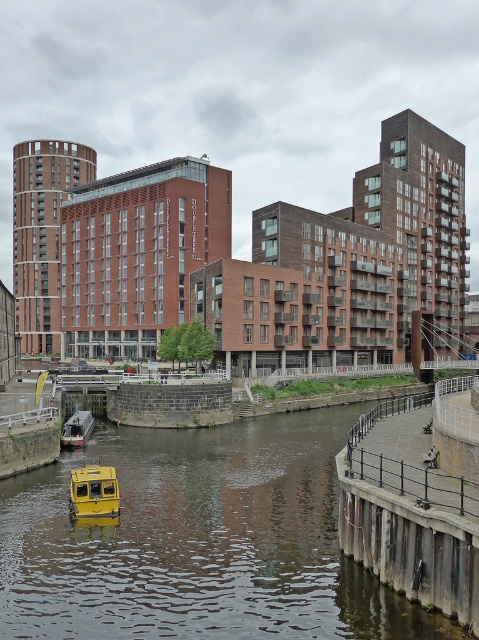
Is yellow rubber boat at center smaller than metallic gray boat at lower left?

No, yellow rubber boat at center is not smaller than metallic gray boat at lower left.

Can you confirm if yellow rubber boat at center is taller than metallic gray boat at lower left?

Yes.

Which is in front, point (261, 484) or point (68, 429)?

Positioned in front is point (261, 484).

Identify the location of yellow rubber boat at center. pos(198,541).

Who is taller, concrete dock at lower right or yellow matte boat at lower center?

With more height is concrete dock at lower right.

Does concrete dock at lower right come behind yellow matte boat at lower center?

No, it is in front of yellow matte boat at lower center.

You are a GUI agent. You are given a task and a screenshot of the screen. Output one action in this format:
    pyautogui.click(x=<x>, y=<y>)
    Task: Click on the concrete dock at lower right
    Image resolution: width=479 pixels, height=640 pixels.
    Given the screenshot: What is the action you would take?
    pyautogui.click(x=410, y=547)

I want to click on yellow rubber boat at center, so click(x=198, y=541).

The image size is (479, 640). What do you see at coordinates (198, 541) in the screenshot?
I see `yellow rubber boat at center` at bounding box center [198, 541].

Is point (40, 611) positioned in front of point (425, 515)?

No, it is behind (425, 515).

Where is `yellow rubber boat at center`? This screenshot has width=479, height=640. yellow rubber boat at center is located at coordinates (198, 541).